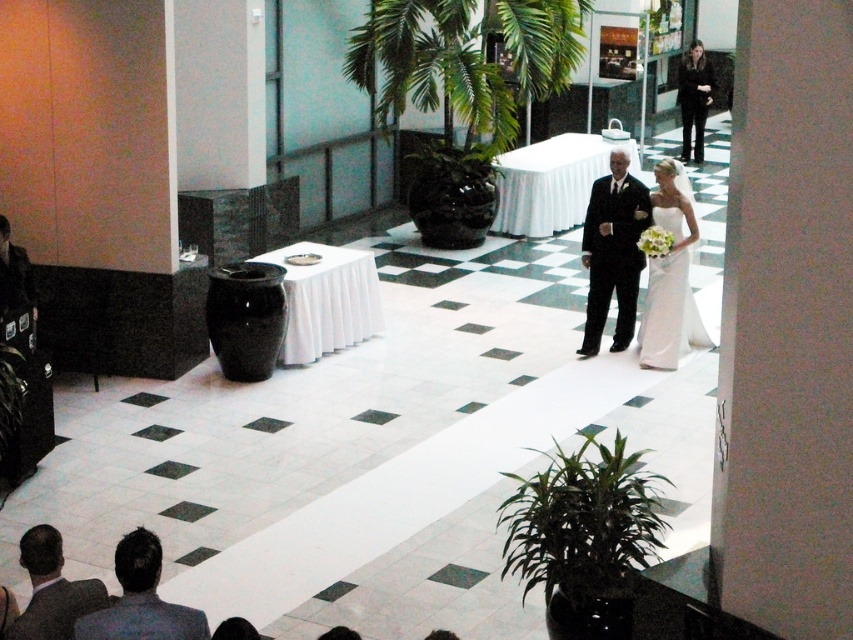
Is matte black suit at center wider than dark gray suit at lower left?

Indeed, matte black suit at center has a greater width compared to dark gray suit at lower left.

Who is more distant from viewer, [596,189] or [38,625]?

Positioned behind is point [596,189].

The height and width of the screenshot is (640, 853). I want to click on matte black suit at center, so click(613, 252).

Does gray suit at lower left appear over dark gray suit at lower left?

Actually, gray suit at lower left is below dark gray suit at lower left.

In the scene shown: How far apart are gray suit at lower left and dark gray suit at lower left?

A distance of 12.79 inches exists between gray suit at lower left and dark gray suit at lower left.

Between point (142, 536) and point (32, 540), which one is positioned behind?

Point (32, 540)

You are a GUI agent. You are given a task and a screenshot of the screen. Output one action in this format:
    pyautogui.click(x=<x>, y=<y>)
    Task: Click on the gray suit at lower left
    The height and width of the screenshot is (640, 853).
    Given the screenshot: What is the action you would take?
    pyautogui.click(x=141, y=600)

Can you confirm if matte black suit at center is positioned above gray suit at lower left?

Indeed, matte black suit at center is positioned over gray suit at lower left.

Can you confirm if matte black suit at center is positioned below gray suit at lower left?

Incorrect, matte black suit at center is not positioned below gray suit at lower left.

Where is `matte black suit at center`? Image resolution: width=853 pixels, height=640 pixels. matte black suit at center is located at coordinates (613, 252).